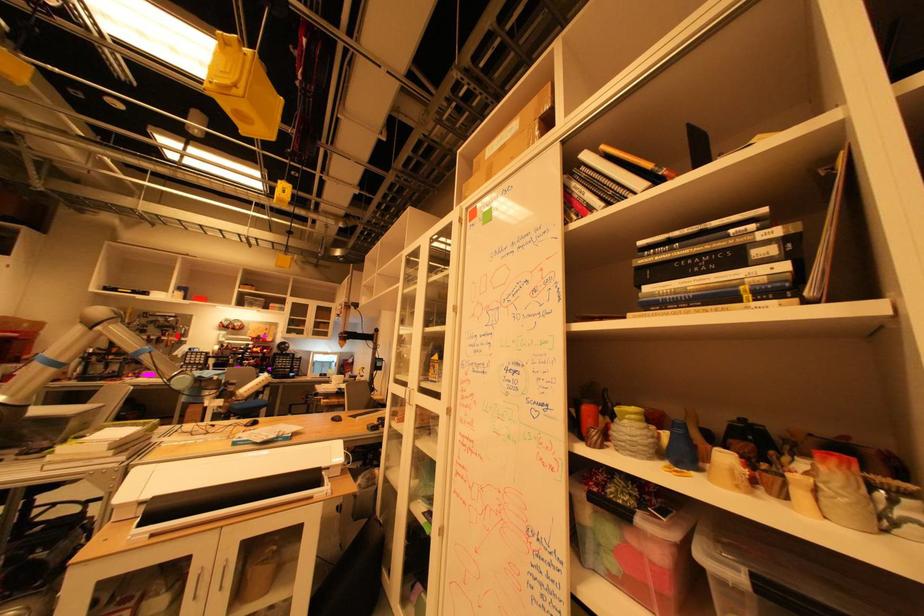
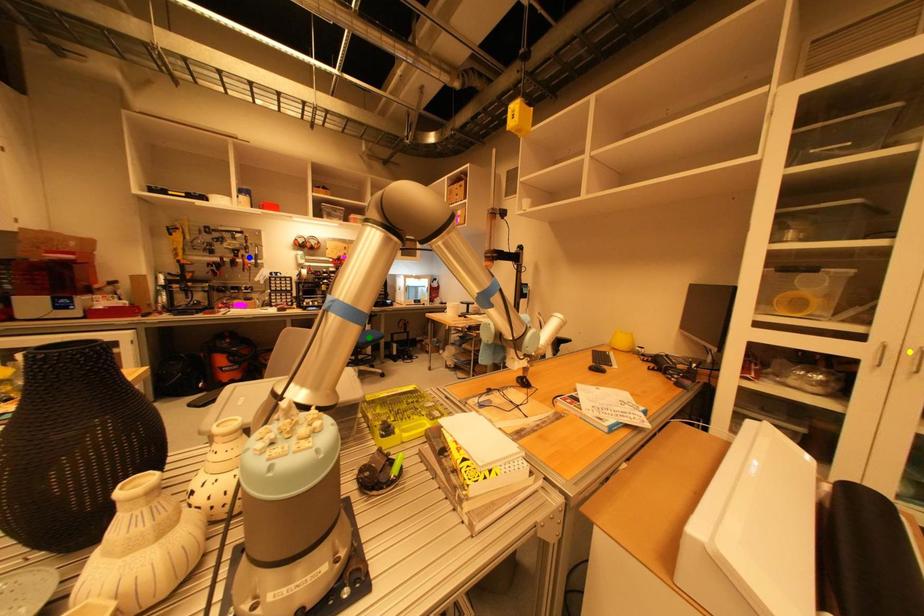
Question: I am providing you with two images of the same scene from different viewpoints. A red point is marked on the first image. You are given multiple points on the second image. Which mark in image 2 goes with the point in image 1?

Choices:
 (A) yellow point
 (B) blue point
 (C) green point

Answer: (B)